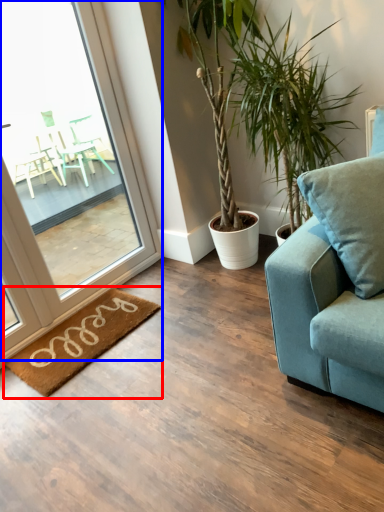
Question: Which of the following is the closest to the observer, mat (highlighted by a red box) or window (highlighted by a blue box)?

Choices:
 (A) mat
 (B) window

Answer: (B)